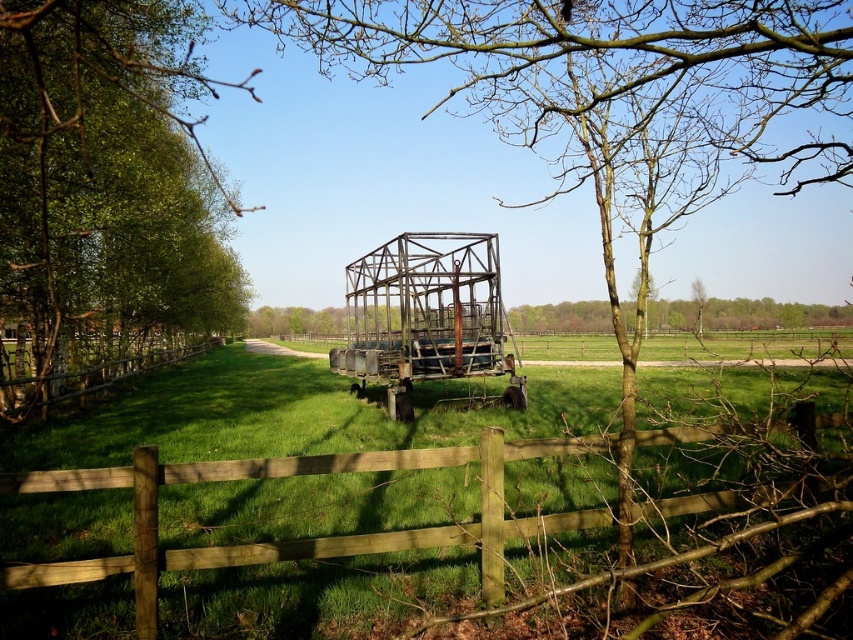
You are standing in the field looking at the image. Which object, the bare branches at center or the brown wooden fence at center, would appear larger to you?

The bare branches at center would appear larger because they are closer to the viewer than the brown wooden fence at center.

You are standing at the center of the field in the image. If you face the green leafy tree at left, which direction should you turn to look towards the wooden fence in the foreground?

The green leafy tree at left is positioned at point (x=105, y=196). Since you are facing the tree, which is to your left, turning to your right would orient you towards the wooden fence in the foreground.

You are standing at the center of the image. Looking towards the direction of the large abandoned metal structure, will you see the bare branches at center blocking your view? Please explain your reasoning.

The bare branches at center are located at point (602, 68), which is in the immediate foreground. Since they are in front of the large abandoned metal structure, they would block the view of the structure when looking from the center position.